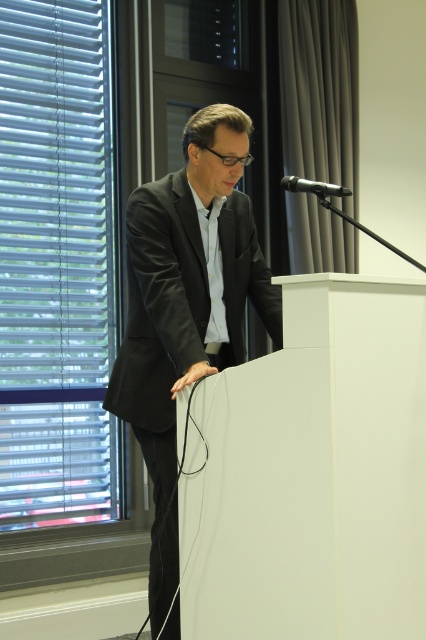
You are an event photographer positioned behind the podium. You need to capture a photo of the matte black suit at center and the black metallic microphone at upper center. Which object will appear closer to you in the photo?

The matte black suit at center will appear closer to you in the photo because it is further to the viewer than the black metallic microphone at upper center.

You are standing in front of the podium and want to place a small decorative item at point (x=206, y=150). If your hand can reach up to 7 feet, will you be able to reach that point?

The distance of point (x=206, y=150) from viewer is 7.68 feet, which is beyond your hand reach of 7 feet. You cannot place the item there.

You are an event organizer and need to place a 0.5 meters wide decorative stand next to the matte black suit at center. Is there enough space at the coordinates provided?

The matte black suit at center is located at point (187, 307). Since the stand is 0.5 meters wide, you need to check the available space around those coordinates to ensure it fits without overlapping the suit. However, without specific spatial dimensions of the area, it is uncertain if there is enough space.